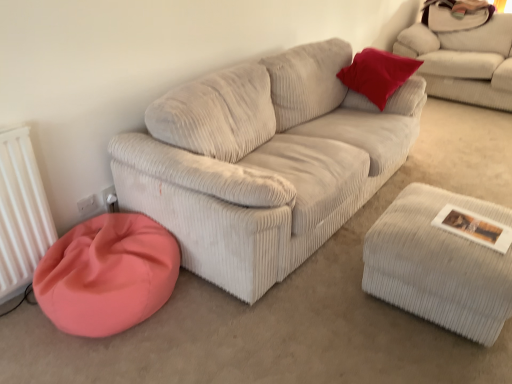
Question: From a real-world perspective, is white corduroy stool at lower right positioned above or below coral fabric bean bag at lower left?

Choices:
 (A) above
 (B) below

Answer: (A)

Question: Looking at their shapes, would you say white corduroy stool at lower right is wider or thinner than coral fabric bean bag at lower left?

Choices:
 (A) thin
 (B) wide

Answer: (B)

Question: Which object is the farthest from the white corduroy stool at lower right?

Choices:
 (A) coral fabric bean bag at lower left
 (B) white corduroy couch at upper right

Answer: (B)

Question: Based on their relative distances, which object is nearer to the white corduroy stool at lower right?

Choices:
 (A) coral fabric bean bag at lower left
 (B) white corduroy couch at upper right

Answer: (A)